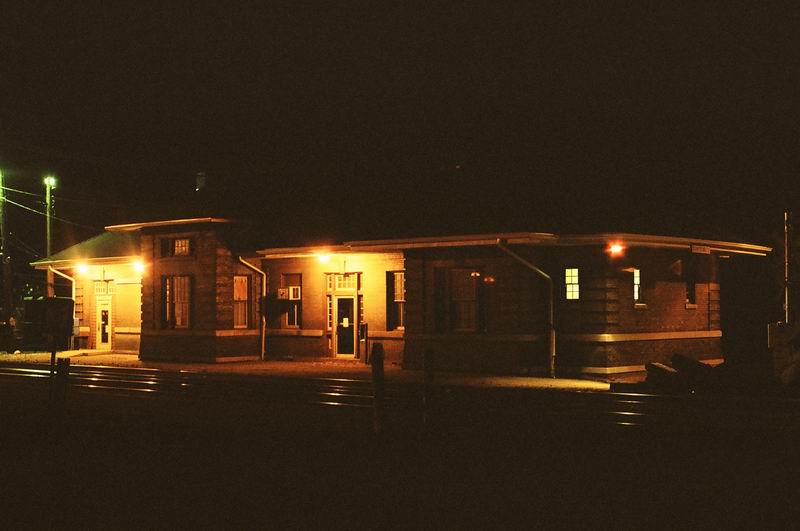
Where is `white chimney`? The image size is (800, 531). white chimney is located at coordinates (202, 184).